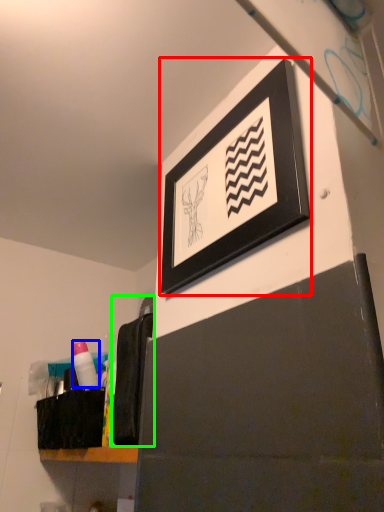
Question: Based on their relative distances, which object is nearer to picture frame (highlighted by a red box)? Choose from toiletry (highlighted by a blue box) and laundry (highlighted by a green box).

Choices:
 (A) toiletry
 (B) laundry

Answer: (B)